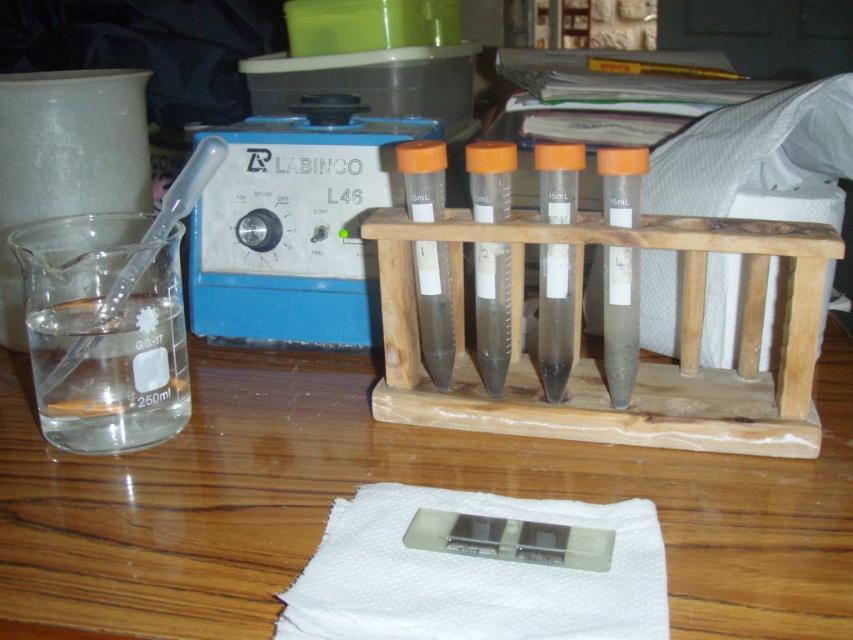
Question: Considering the real-world distances, which object is farthest from the transparent glass beaker at left?

Choices:
 (A) wooden table at center
 (B) transparent wood test tube rack at center

Answer: (B)

Question: Is the position of transparent wood test tube rack at center less distant than that of transparent glass beaker at left?

Choices:
 (A) yes
 (B) no

Answer: (A)

Question: Which object is farther from the camera taking this photo?

Choices:
 (A) transparent glass beaker at left
 (B) transparent wood test tube rack at center

Answer: (A)

Question: Does wooden table at center appear under transparent wood test tube rack at center?

Choices:
 (A) yes
 (B) no

Answer: (A)

Question: Is transparent wood test tube rack at center below transparent glass beaker at left?

Choices:
 (A) no
 (B) yes

Answer: (A)

Question: Estimate the real-world distances between objects in this image. Which object is farther from the transparent wood test tube rack at center?

Choices:
 (A) wooden table at center
 (B) transparent glass beaker at left

Answer: (B)